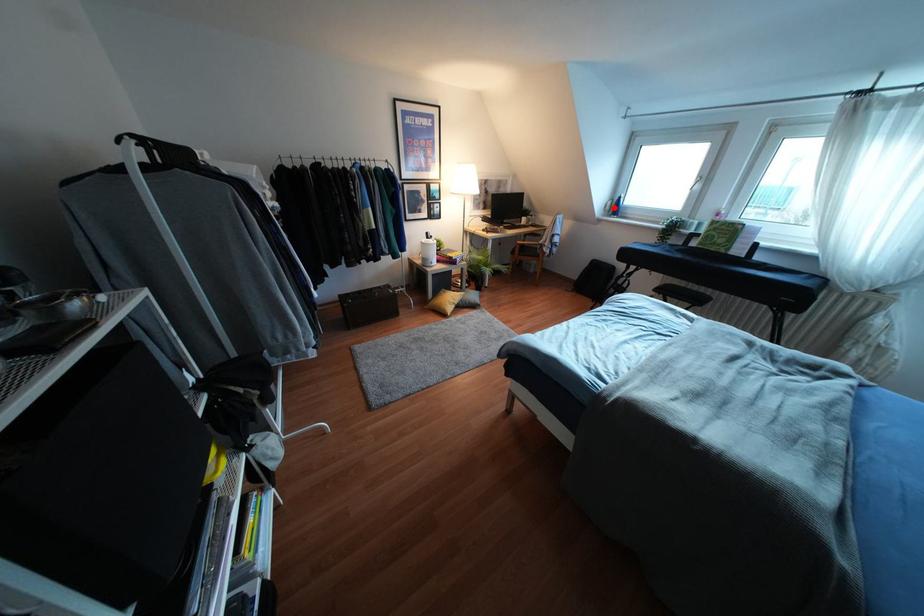
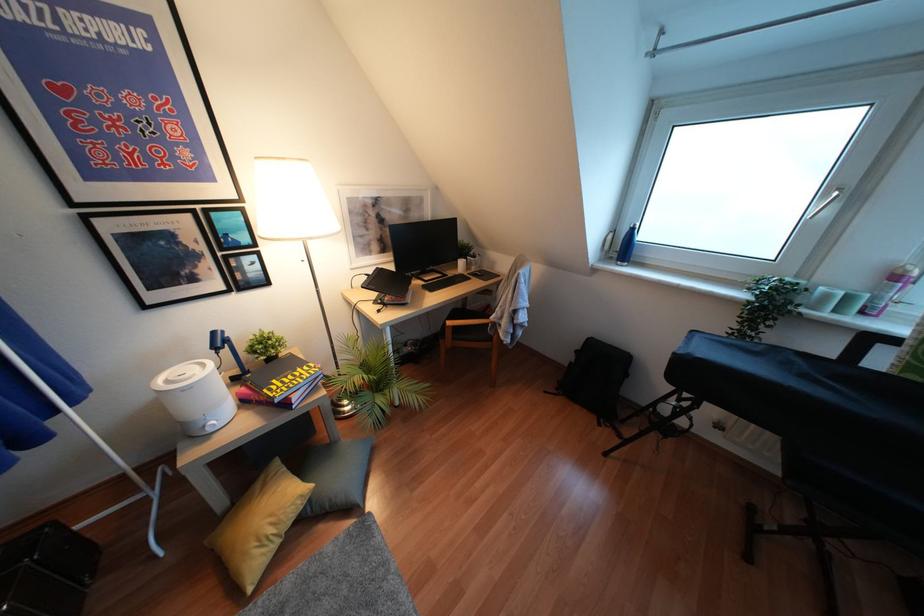
In the second image, find the point that corresponds to the highlighted location in the first image.

(623, 246)